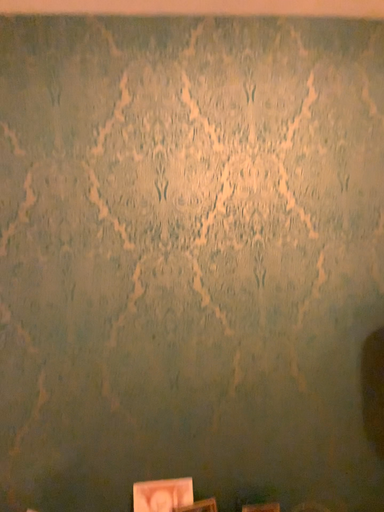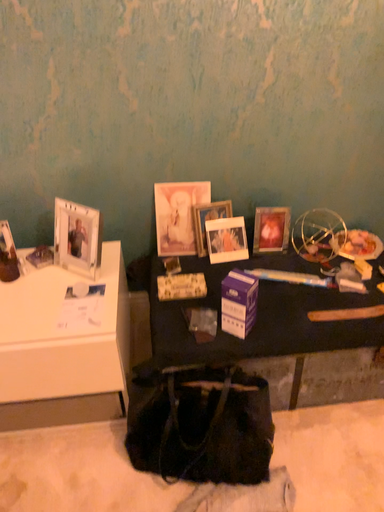
Question: Which way did the camera rotate in the video?

Choices:
 (A) rotated upward
 (B) rotated downward

Answer: (B)